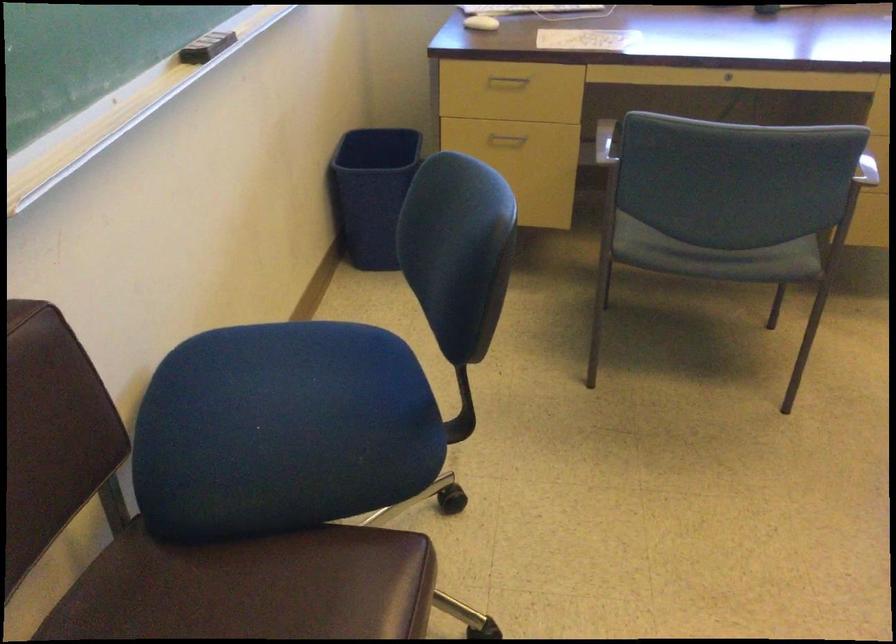
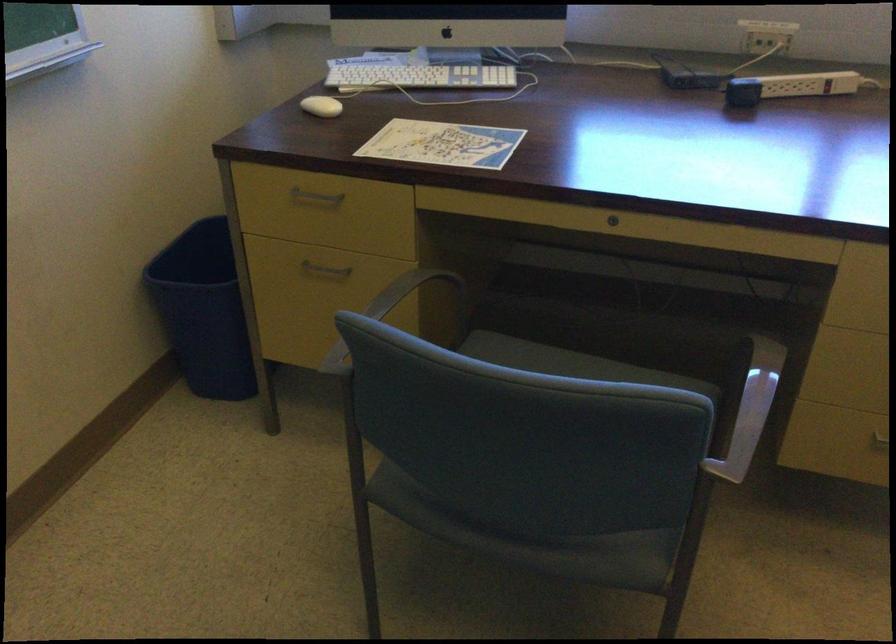
Find the pixel in the second image that matches (727,73) in the first image.

(613, 220)